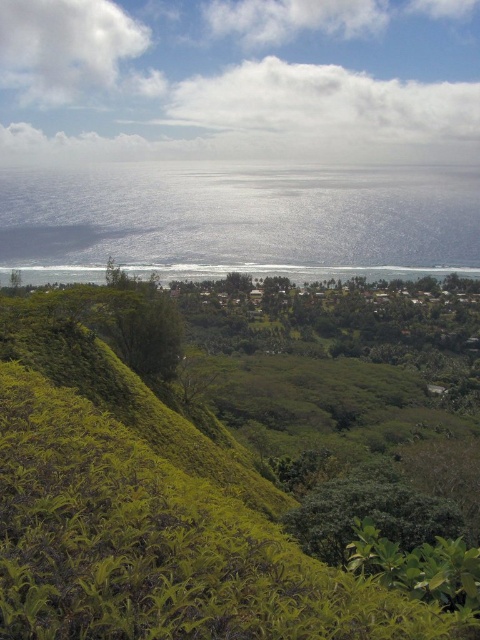
Question: Is green leafy shrubs at lower left to the left of blue reflective water at center from the viewer's perspective?

Choices:
 (A) no
 (B) yes

Answer: (B)

Question: Is green leafy shrubs at lower left smaller than blue reflective water at center?

Choices:
 (A) yes
 (B) no

Answer: (A)

Question: Which point appears farthest from the camera in this image?

Choices:
 (A) (97, 490)
 (B) (385, 273)

Answer: (B)

Question: Does green leafy shrubs at lower left have a lesser width compared to blue reflective water at center?

Choices:
 (A) yes
 (B) no

Answer: (A)

Question: Which point is farther to the camera?

Choices:
 (A) blue reflective water at center
 (B) green leafy shrubs at lower left

Answer: (A)

Question: Which point is closer to the camera?

Choices:
 (A) blue reflective water at center
 (B) green leafy shrubs at lower left

Answer: (B)